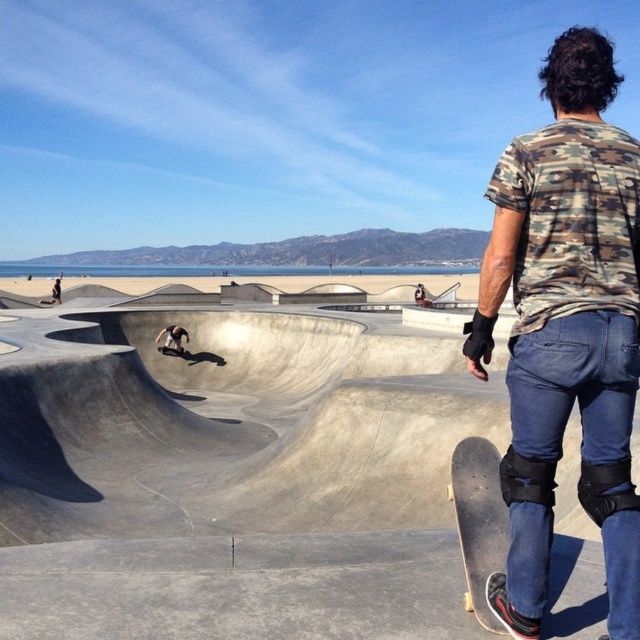
Question: Does concrete skate park at center have a lesser width compared to black smooth skateboard at center?

Choices:
 (A) no
 (B) yes

Answer: (A)

Question: Does concrete skate park at center lie in front of black matte skateboard at lower right?

Choices:
 (A) yes
 (B) no

Answer: (A)

Question: Which of the following is the closest to the observer?

Choices:
 (A) matte black skateboard at center
 (B) concrete skate park at center
 (C) black smooth skateboard at center
 (D) black matte skateboard at lower right

Answer: (B)

Question: Among these objects, which one is nearest to the camera?

Choices:
 (A) black matte skateboard at lower right
 (B) matte black skateboard at center
 (C) black smooth skateboard at center

Answer: (A)

Question: Which object is farther from the camera taking this photo?

Choices:
 (A) camo fabric shirt at upper right
 (B) black matte skateboard at lower right
 (C) concrete skate park at center

Answer: (B)

Question: In this image, where is concrete skate park at center located relative to black smooth skateboard at center?

Choices:
 (A) below
 (B) above

Answer: (A)